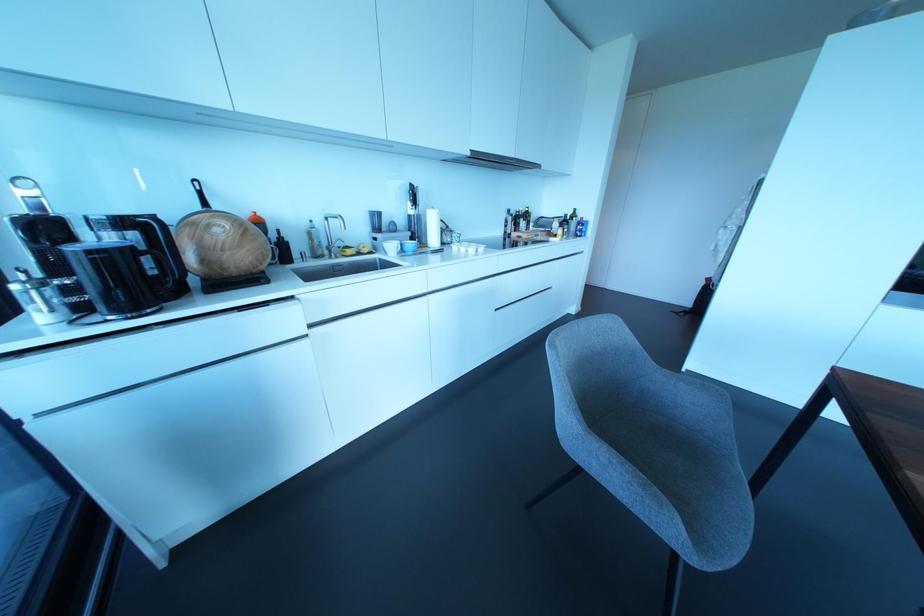
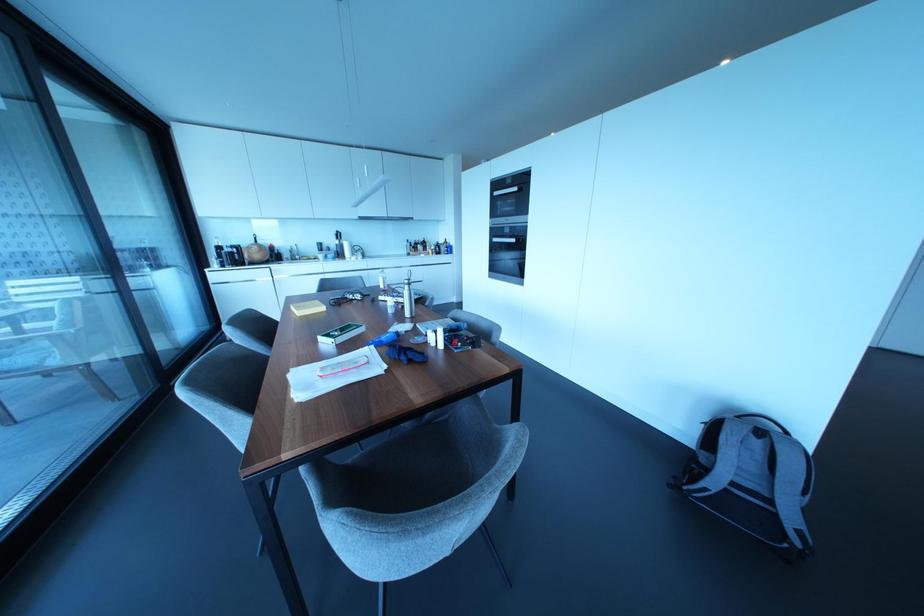
Which direction would the cameraman need to move to produce the second image?

The cameraman walked toward right, backward.